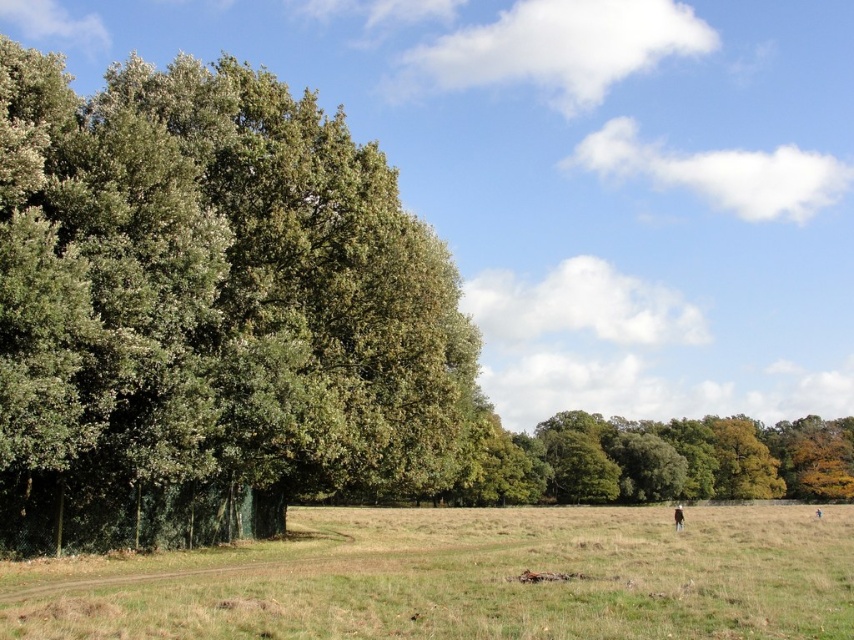
You are standing in the middle of the open grassy field in the rural landscape. You want to walk towards the dense cluster of tall trees on the left. Which direction should you walk to avoid the green grass at lower center?

Walk towards the dense cluster of tall trees on the left while staying away from the green grass at lower center located at point (463, 577).